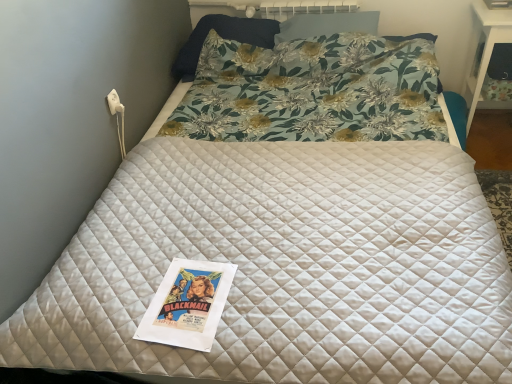
Question: Does white glossy table at upper right have a lesser height compared to floral fabric pillow at upper center, which appears as the second pillow when viewed from the left?

Choices:
 (A) yes
 (B) no

Answer: (B)

Question: Considering the relative sizes of white glossy table at upper right and floral fabric pillow at upper center, which is the 1th pillow in right-to-left order, in the image provided, is white glossy table at upper right wider than floral fabric pillow at upper center, which is the 1th pillow in right-to-left order,?

Choices:
 (A) yes
 (B) no

Answer: (A)

Question: From the image's perspective, is white glossy table at upper right located above floral fabric pillow at upper center, which is the 1th pillow in right-to-left order?

Choices:
 (A) yes
 (B) no

Answer: (B)

Question: Is white glossy table at upper right bigger than floral fabric pillow at upper center, which appears as the second pillow when viewed from the left?

Choices:
 (A) no
 (B) yes

Answer: (B)

Question: From the image's perspective, is white glossy table at upper right below floral fabric pillow at upper center, which appears as the second pillow when viewed from the left?

Choices:
 (A) no
 (B) yes

Answer: (B)

Question: From a real-world perspective, is white glossy table at upper right located higher than floral fabric pillow at upper center, which is the 1th pillow in right-to-left order?

Choices:
 (A) no
 (B) yes

Answer: (A)

Question: Is floral fabric pillow at upper center, which appears as the second pillow when viewed from the left, positioned in front of white glossy table at upper right?

Choices:
 (A) no
 (B) yes

Answer: (A)

Question: Is floral fabric pillow at upper center, which appears as the second pillow when viewed from the left, at the right side of white glossy table at upper right?

Choices:
 (A) yes
 (B) no

Answer: (B)

Question: Can you confirm if floral fabric pillow at upper center, which is the 1th pillow in right-to-left order, is bigger than white glossy table at upper right?

Choices:
 (A) no
 (B) yes

Answer: (A)

Question: Considering the relative sizes of floral fabric pillow at upper center, which appears as the second pillow when viewed from the left, and white glossy table at upper right in the image provided, is floral fabric pillow at upper center, which appears as the second pillow when viewed from the left, wider than white glossy table at upper right?

Choices:
 (A) yes
 (B) no

Answer: (B)

Question: Could you tell me if floral fabric pillow at upper center, which appears as the second pillow when viewed from the left, is facing white glossy table at upper right?

Choices:
 (A) yes
 (B) no

Answer: (B)

Question: Can you confirm if floral fabric pillow at upper center, which appears as the second pillow when viewed from the left, is smaller than white glossy table at upper right?

Choices:
 (A) yes
 (B) no

Answer: (A)

Question: Can you confirm if floral fabric pillow at upper center, positioned as the second pillow in right-to-left order, is shorter than white glossy table at upper right?

Choices:
 (A) no
 (B) yes

Answer: (B)